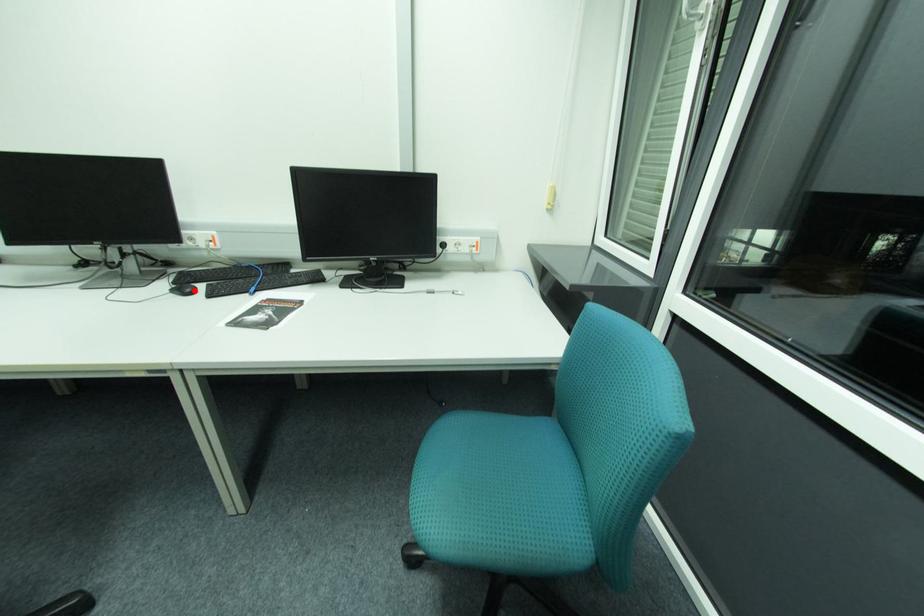
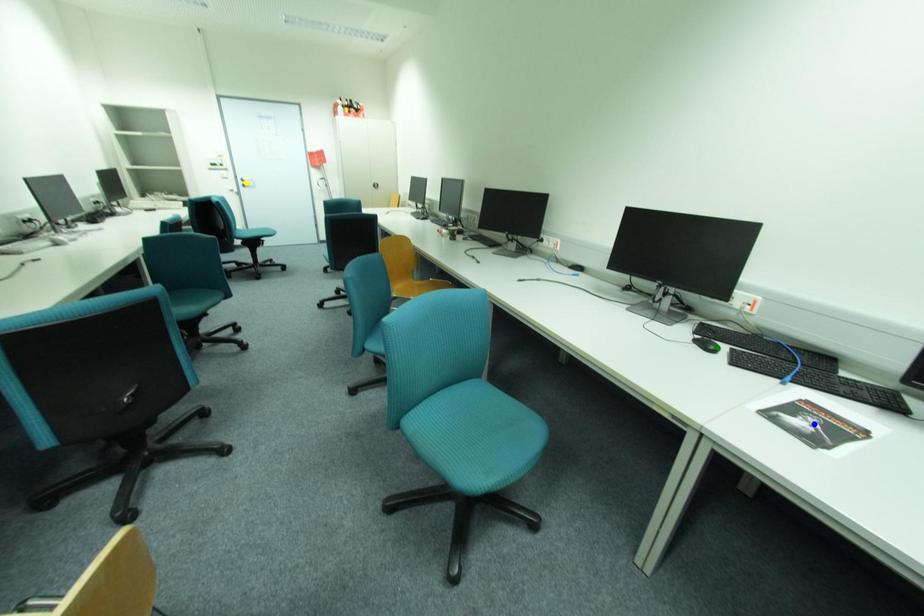
Question: I am providing you with two images of the same scene from different viewpoints. A red point is marked on the first image. You are given multiple points on the second image. Which point in image 2 represents the same 3d spot as the red point in image 1?

Choices:
 (A) yellow point
 (B) blue point
 (C) green point

Answer: (C)